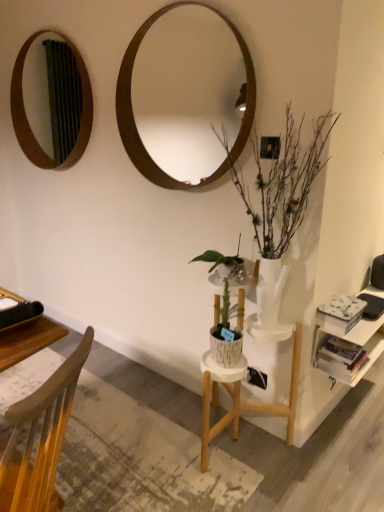
Question: From a real-world perspective, is wooden mirror at upper center, the first mirror viewed from the front, beneath white glossy vase at right?

Choices:
 (A) no
 (B) yes

Answer: (A)

Question: Is wooden mirror at upper center, the first mirror viewed from the front, far from white glossy vase at right?

Choices:
 (A) no
 (B) yes

Answer: (B)

Question: Is wooden mirror at upper center, which ranks as the 1th mirror in right-to-left order, oriented away from white glossy vase at right?

Choices:
 (A) yes
 (B) no

Answer: (B)

Question: Is wooden mirror at upper center, marked as the second mirror in a back-to-front arrangement, with white glossy vase at right?

Choices:
 (A) yes
 (B) no

Answer: (B)

Question: From the image's perspective, is wooden mirror at upper center, the first mirror viewed from the front, above white glossy vase at right?

Choices:
 (A) yes
 (B) no

Answer: (A)

Question: Considering their positions, is white matte book at right, the 2th book ordered from the bottom, located in front of or behind white matte bookshelf at right?

Choices:
 (A) front
 (B) behind

Answer: (A)

Question: Is white matte book at right, acting as the 1th book starting from the top, to the left or to the right of white matte bookshelf at right in the image?

Choices:
 (A) right
 (B) left

Answer: (B)

Question: Considering the positions of point (322, 322) and point (332, 327), is point (322, 322) closer or farther from the camera than point (332, 327)?

Choices:
 (A) farther
 (B) closer

Answer: (A)

Question: Looking at the image, does white matte book at right, the 2th book ordered from the bottom, seem bigger or smaller compared to white matte bookshelf at right?

Choices:
 (A) small
 (B) big

Answer: (A)

Question: Choose the correct answer: Is wooden mirror at upper left, placed as the first mirror when sorted from left to right, inside white glossy vase at right or outside it?

Choices:
 (A) outside
 (B) inside

Answer: (A)

Question: Considering the positions of wooden mirror at upper left, placed as the first mirror when sorted from left to right, and white glossy vase at right in the image, is wooden mirror at upper left, placed as the first mirror when sorted from left to right, bigger or smaller than white glossy vase at right?

Choices:
 (A) small
 (B) big

Answer: (A)

Question: Is point click(33, 94) closer or farther from the camera than point click(279, 198)?

Choices:
 (A) farther
 (B) closer

Answer: (A)

Question: From a real-world perspective, is wooden mirror at upper left, the 2th mirror from the right, above or below white glossy vase at right?

Choices:
 (A) above
 (B) below

Answer: (A)

Question: Visually, is wooden mirror at upper center, marked as the second mirror in a back-to-front arrangement, positioned to the left or to the right of wooden mirror at upper left, placed as the first mirror when sorted from left to right?

Choices:
 (A) right
 (B) left

Answer: (A)

Question: In terms of width, does wooden mirror at upper center, marked as the second mirror in a back-to-front arrangement, look wider or thinner when compared to wooden mirror at upper left, the 2th mirror from the right?

Choices:
 (A) thin
 (B) wide

Answer: (B)